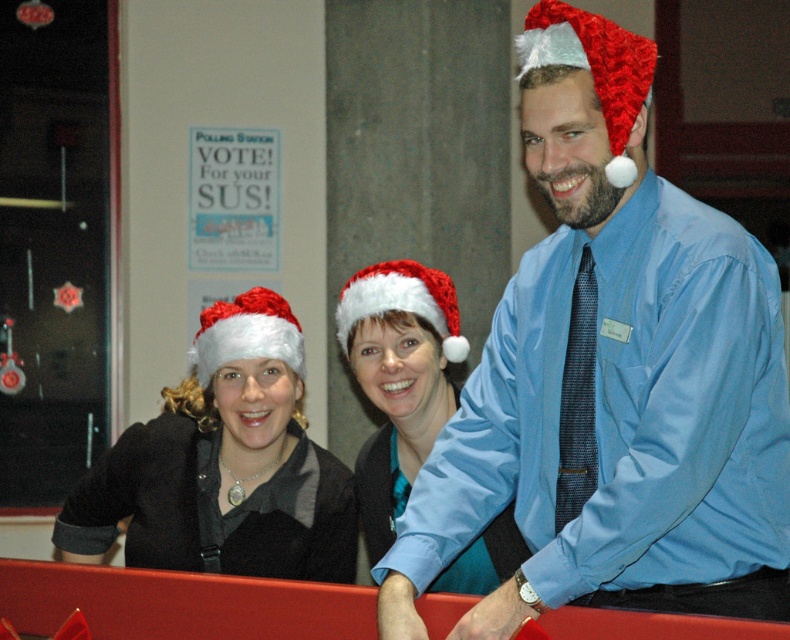
You are organizing a holiday photo shoot and need to arrange the black matte santa hat at left and the white fuzzy santa hat at left correctly. According to the scene description, which Santa hat is positioned to the left of the other?

The black matte santa hat at left is to the left of the white fuzzy santa hat at left.

You are taking a photo of the group and need to ensure the black matte Santa hat at left is centered in the frame. Given its current coordinates at point 0.728, 0.285, what adjustment should you make to the camera position?

The black matte Santa hat at left is located at point (224, 465). To center it, move the camera slightly to the left and down to align the hat with the frame center.